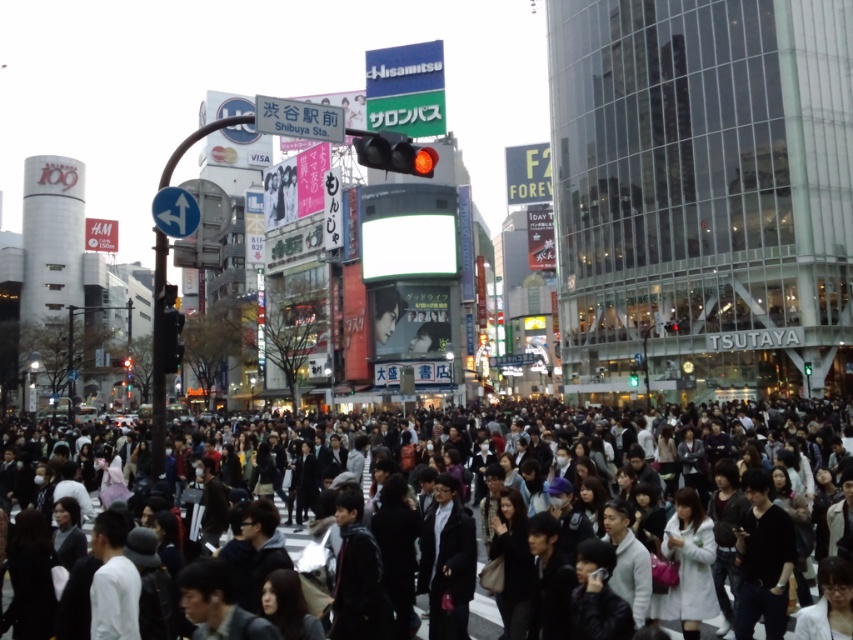
From the picture: You are a photographer trying to capture a candid shot of the dark gray jacket at center and the black leather jacket at center in the busy Tokyo intersection. Since you want to ensure both jackets are clearly visible in the frame, which jacket should you focus on first to account for their sizes?

The dark gray jacket at center is bigger than the black leather jacket at center, so you should focus on the dark gray jacket at center first to ensure it fits well in the frame before adjusting for the smaller black leather jacket at center.

You are a photographer standing at the intersection in Tokyo, Japan. You want to take a photo of the dark gray jacket at center. Where should you aim your camera to capture it?

You should aim your camera at the point with coordinates (358, 577) to capture the dark gray jacket at center.

Based on the photo, you are a photographer standing at the Shibuya crossing. You notice two people in the crowd wearing dark gray clothing at center and gray sweater at center. Which of these is closer to the ground?

The dark gray clothing at center is closer to the ground because it is positioned below the gray sweater at center.